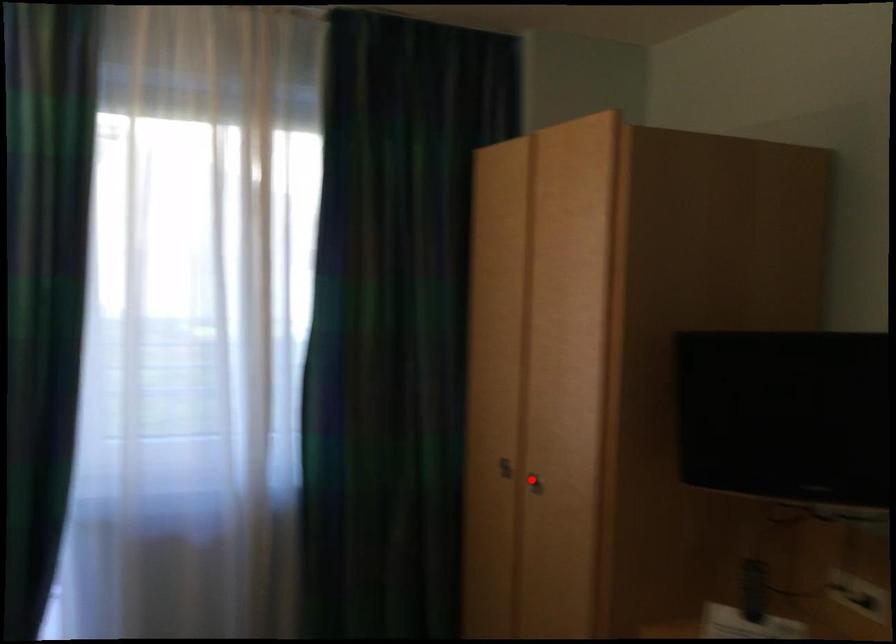
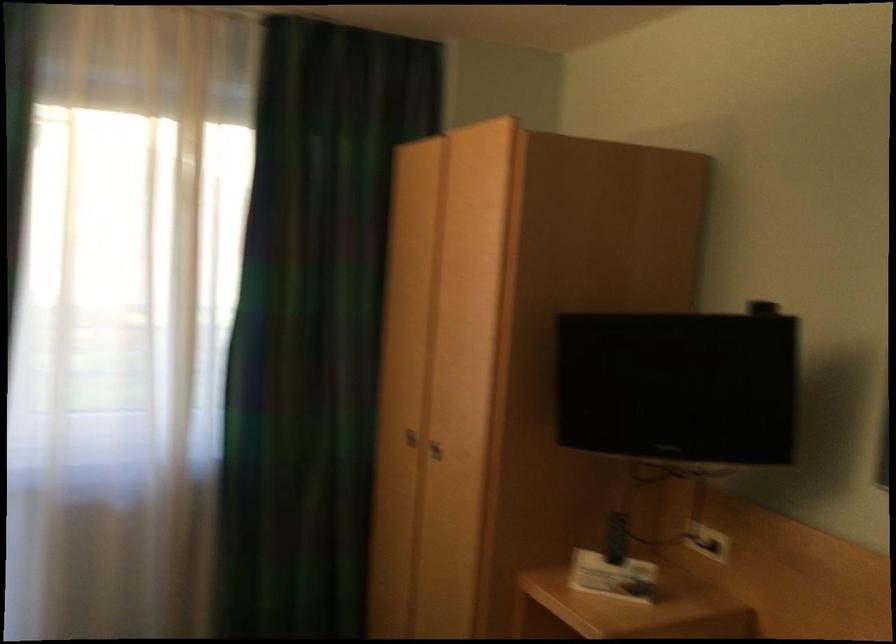
In the second image, find the point that corresponds to the highlighted location in the first image.

(435, 450)